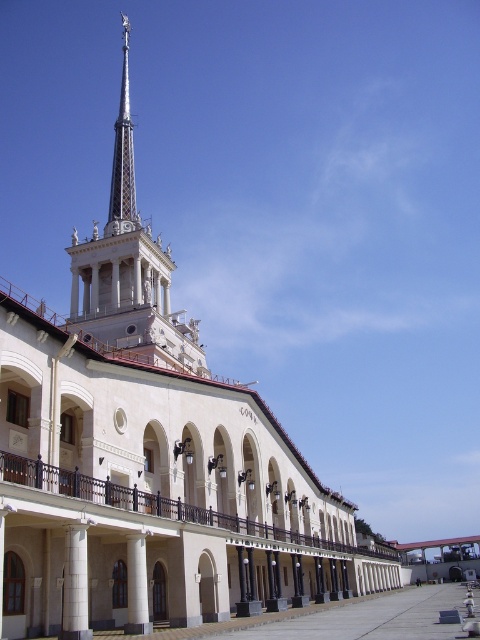
Between white stone column at lower left and white smooth pillar at center, which one appears on the left side from the viewer's perspective?

From the viewer's perspective, white stone column at lower left appears more on the left side.

Does point (69, 589) lie behind point (131, 536)?

No, (69, 589) is in front of (131, 536).

Image resolution: width=480 pixels, height=640 pixels. In order to click on white stone column at lower left in this screenshot , I will do `click(74, 584)`.